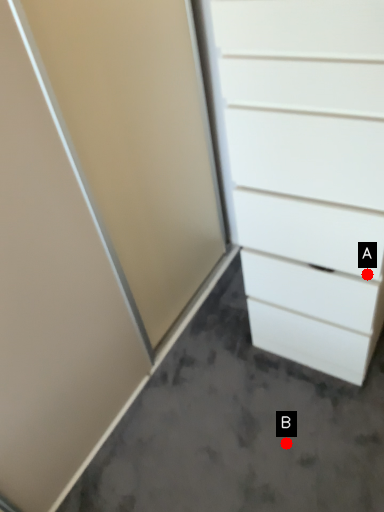
Question: Two points are circled on the image, labeled by A and B beside each circle. Among these points, which one is farthest from the camera?

Choices:
 (A) A is further
 (B) B is further

Answer: (B)